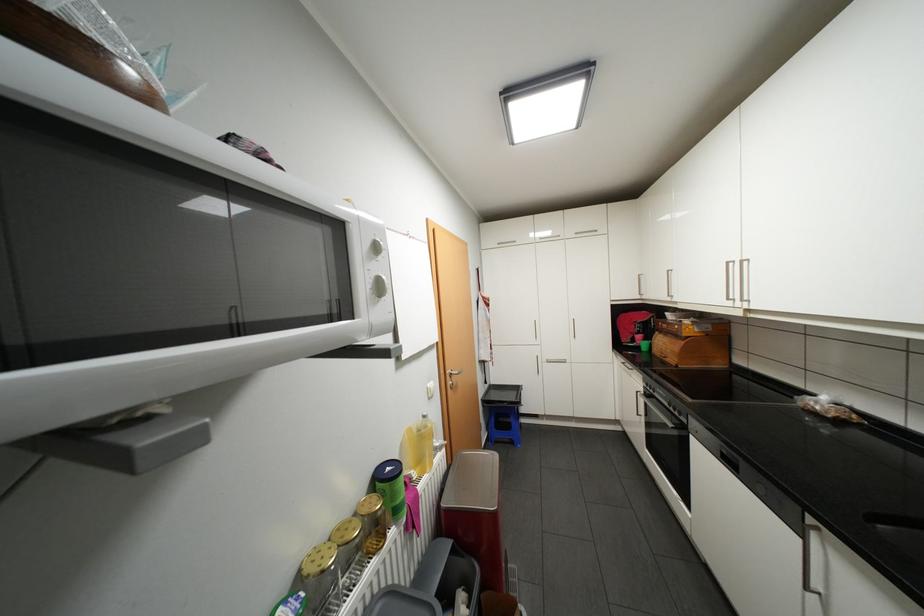
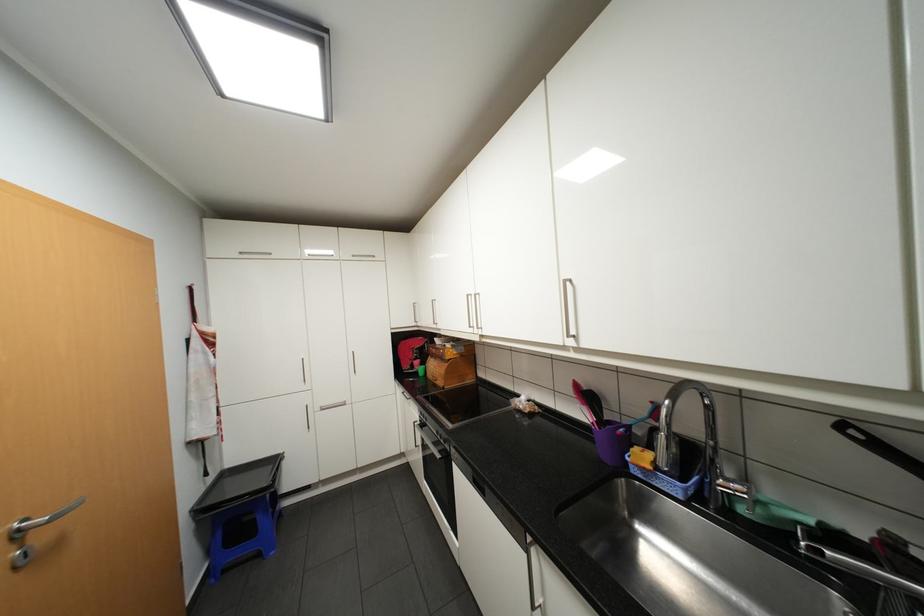
The point at [663,294] is marked in the first image. Where is the corresponding point in the second image?

(434, 323)